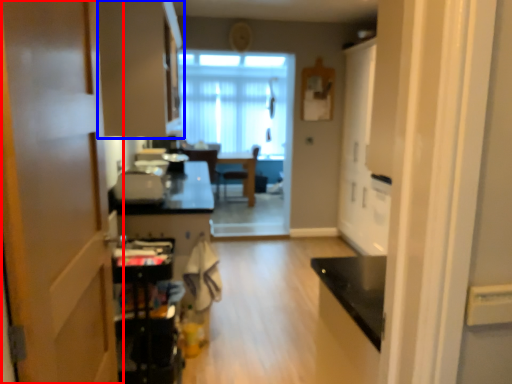
Question: Which of the following is the closest to the observer, door (highlighted by a red box) or cabinetry (highlighted by a blue box)?

Choices:
 (A) door
 (B) cabinetry

Answer: (A)